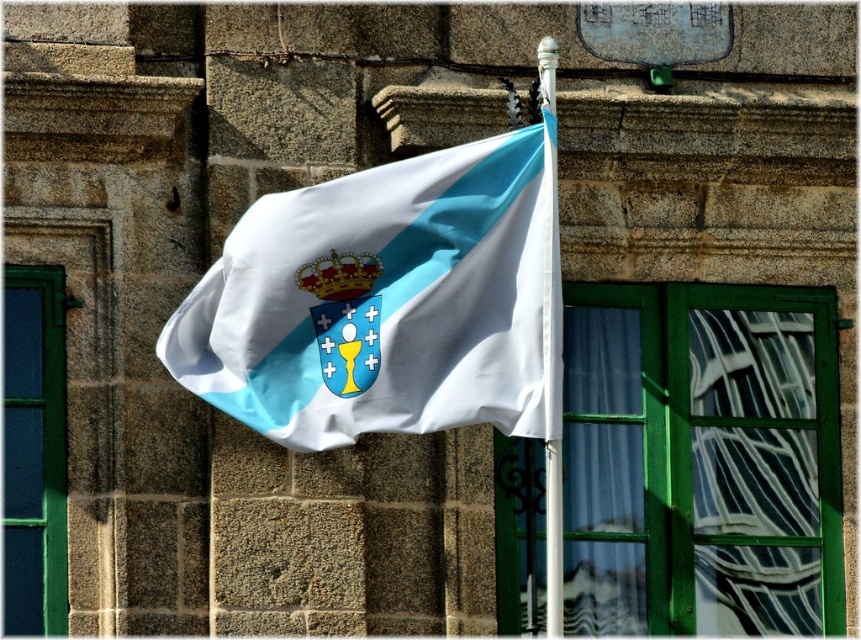
Who is shorter, silky white flag at center or gold metallic crown at center?

With less height is silky white flag at center.

Between point (296, 438) and point (311, 275), which one is positioned behind?

Positioned behind is point (311, 275).

Is point (379, 403) positioned behind point (321, 257)?

No, it is in front of (321, 257).

Image resolution: width=861 pixels, height=640 pixels. What are the coordinates of `silky white flag at center` in the screenshot? It's located at (388, 301).

I want to click on white plastic flag pole at center, so (x=552, y=412).

Measure the distance between point (549, 552) and camera.

They are 54.75 meters apart.

Is point (550, 628) farther from viewer compared to point (333, 250)?

No, (550, 628) is in front of (333, 250).

At what (x,y) coordinates should I click in order to perform the action: click on white plastic flag pole at center. Please return your answer as a coordinate pair (x, y). Image resolution: width=861 pixels, height=640 pixels. Looking at the image, I should click on (552, 412).

Is silky white flag at center shorter than white plastic flag pole at center?

Yes.

Does point (525, 339) come closer to viewer compared to point (554, 605)?

No, it is not.

Is point (500, 268) farther from viewer compared to point (547, 339)?

Yes.

Find the location of `silky white flag at center`. silky white flag at center is located at coordinates (388, 301).